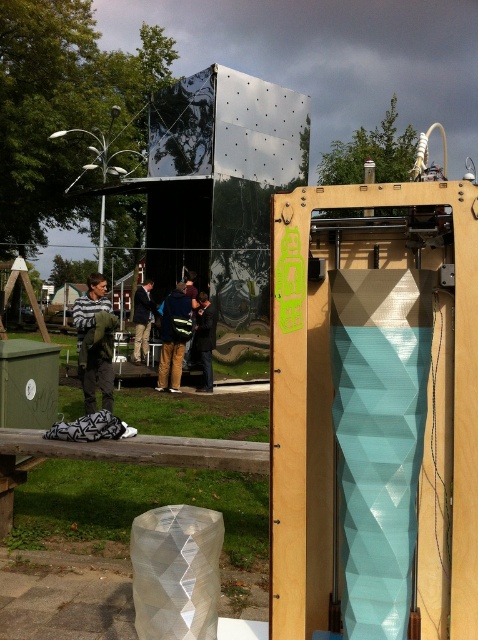
You are an event organizer who needs to retrieve the dark blue jacket at center from under the dark blue backpack at center. Is the jacket accessible without moving the backpack?

The dark blue backpack at center is above the dark blue jacket at center, so the jacket is not fully accessible without moving the backpack.

You are standing in the outdoor scene and want to place a small flag exactly at the point with coordinates (173,337). According to the scene description, which object will the flag be placed on?

The flag will be placed on the dark blue backpack at center because the point (173,337) is on the dark blue backpack at center.

You are an artist trying to decide which jacket to wear for a photoshoot. Both the green fabric jacket at center and the reflective metallic jacket at center are available. Based on their widths, which jacket would you choose if you want a wider silhouette?

The green fabric jacket at center has a greater width than the reflective metallic jacket at center, so it would provide a wider silhouette for the photoshoot.